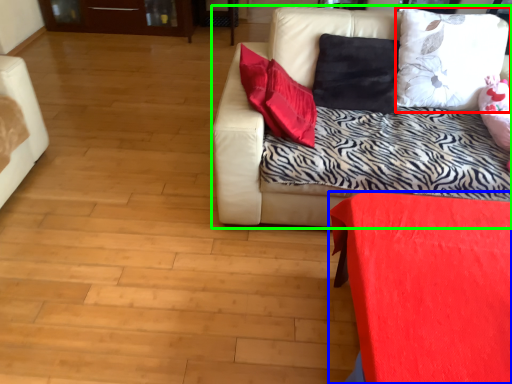
Question: Which is nearer to the pillow (highlighted by a red box)? furniture (highlighted by a blue box) or studio couch (highlighted by a green box).

Choices:
 (A) furniture
 (B) studio couch

Answer: (B)